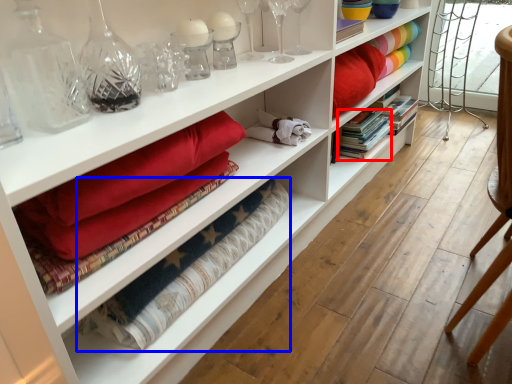
Question: Which object appears farthest to the camera in this image, book (highlighted by a red box) or material (highlighted by a blue box)?

Choices:
 (A) book
 (B) material

Answer: (A)